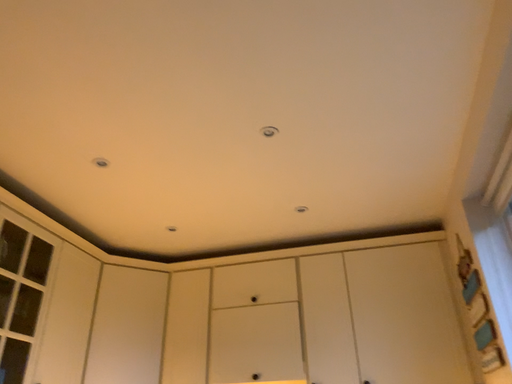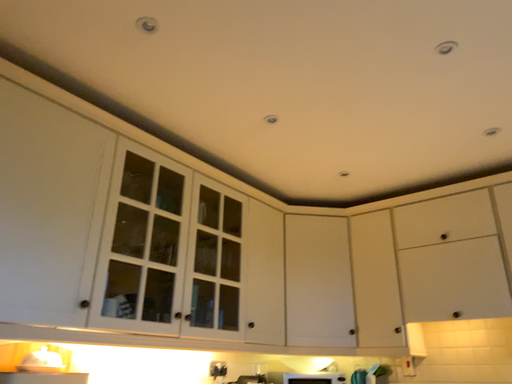
Question: How did the camera likely rotate when shooting the video?

Choices:
 (A) rotated left
 (B) rotated right

Answer: (A)